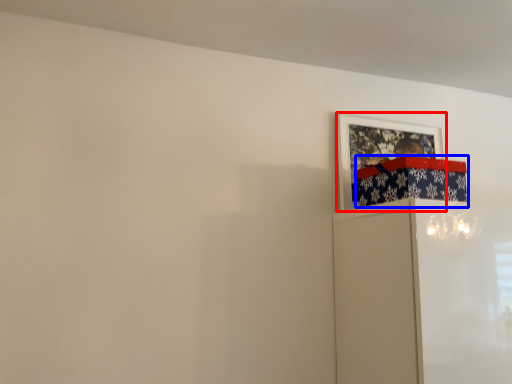
Question: Which of the following is the closest to the observer, picture frame (highlighted by a red box) or wrapping paper (highlighted by a blue box)?

Choices:
 (A) picture frame
 (B) wrapping paper

Answer: (B)